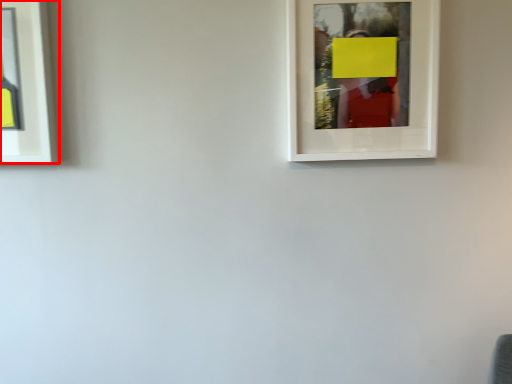
Question: From the image's perspective, what is the correct spatial positioning of picture frame (annotated by the red box) in reference to picture frame?

Choices:
 (A) above
 (B) below

Answer: (B)